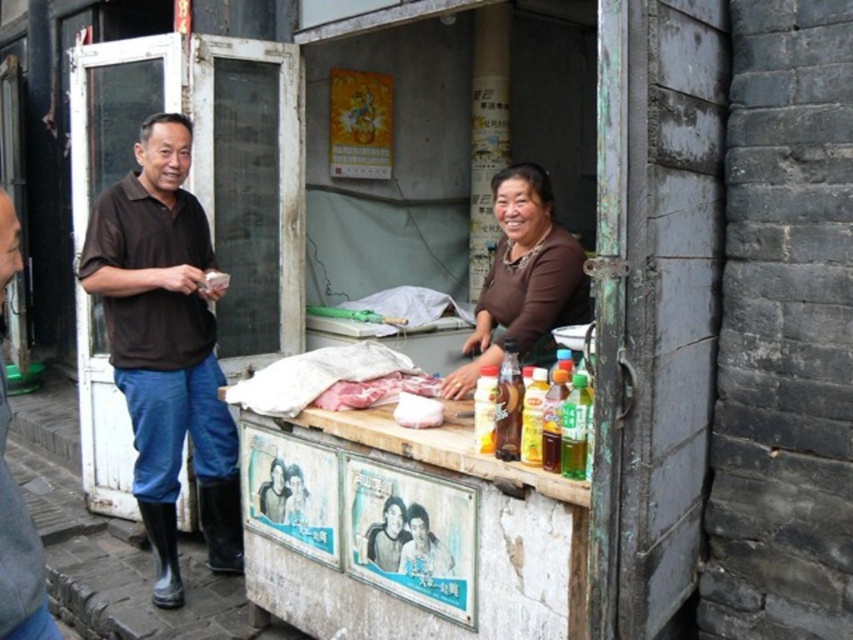
Question: Which of these objects is positioned closest to the brown matte shirt at center?

Choices:
 (A) matte plastic poster at center
 (B) brown cotton shirt at left

Answer: (A)

Question: Considering the real-world distances, which object is closest to the brown matte shirt at center?

Choices:
 (A) matte plastic poster at center
 (B) brown cotton shirt at left

Answer: (A)

Question: Does brown cotton shirt at left have a larger size compared to brown leather jacket at left?

Choices:
 (A) no
 (B) yes

Answer: (B)

Question: Is brown cotton shirt at left bigger than brown matte shirt at center?

Choices:
 (A) yes
 (B) no

Answer: (A)

Question: Which of the following is the farthest from the observer?

Choices:
 (A) brown cotton shirt at left
 (B) brown leather jacket at left
 (C) matte plastic poster at center

Answer: (A)

Question: Is brown leather jacket at left positioned at the back of matte plastic poster at center?

Choices:
 (A) no
 (B) yes

Answer: (A)